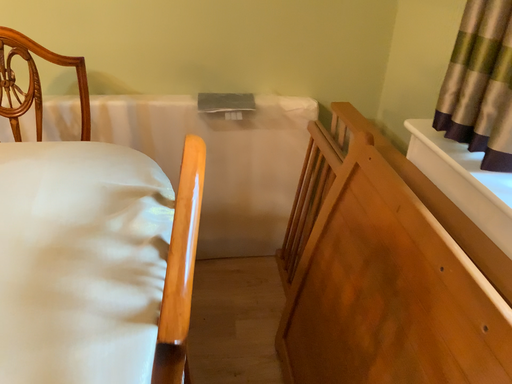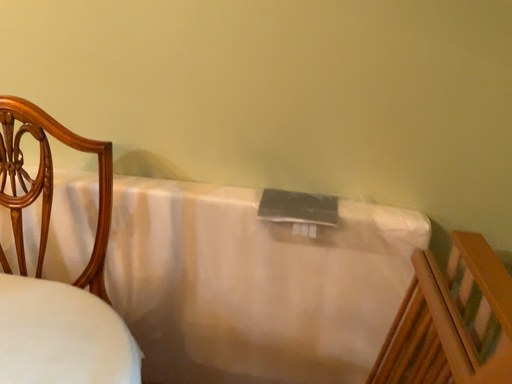
Question: Which way did the camera rotate in the video?

Choices:
 (A) rotated left
 (B) rotated right

Answer: (A)